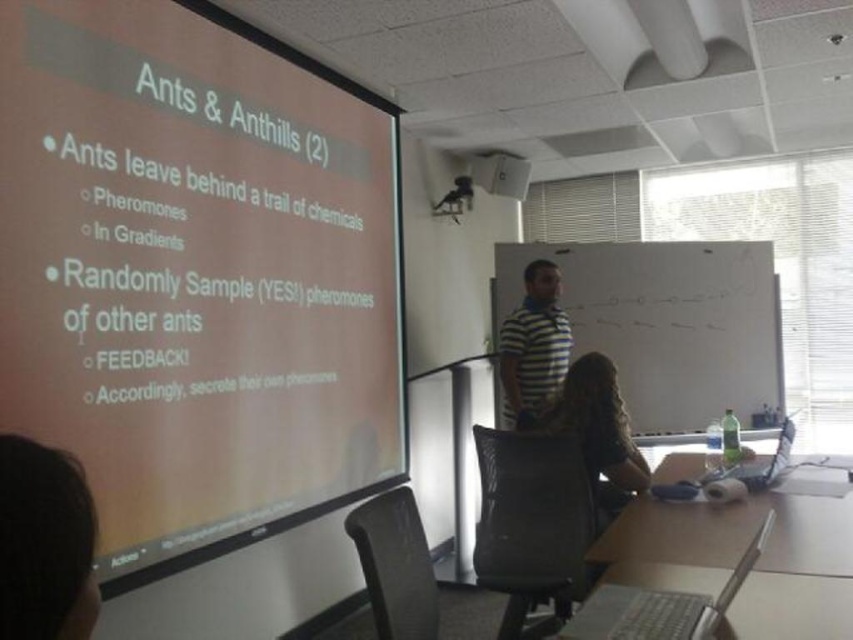
Question: Does whiteboard at center have a greater width compared to wooden table at lower right?

Choices:
 (A) yes
 (B) no

Answer: (A)

Question: Which point appears farthest from the camera in this image?

Choices:
 (A) (664, 612)
 (B) (610, 429)
 (C) (744, 268)
 (D) (48, 490)

Answer: (C)

Question: Which object is closer to the camera taking this photo?

Choices:
 (A) dark brown hair at lower left
 (B) silver metallic laptop at lower right

Answer: (A)

Question: Can you confirm if striped cotton shirt at center is positioned below white plastic projector at upper center?

Choices:
 (A) no
 (B) yes

Answer: (B)

Question: Based on their relative distances, which object is farther from the wooden table at lower right?

Choices:
 (A) silver metallic laptop at lower right
 (B) whiteboard at center
 (C) white plastic projector at upper center
 (D) dark brown leather chair at lower center

Answer: (C)

Question: Is whiteboard at center smaller than dark brown hair at lower left?

Choices:
 (A) yes
 (B) no

Answer: (B)